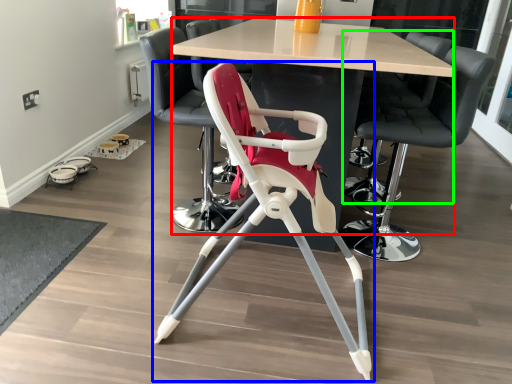
Question: Which object is the closest to the table (highlighted by a red box)? Choose among these: chair (highlighted by a blue box) or chair (highlighted by a green box).

Choices:
 (A) chair
 (B) chair

Answer: (B)